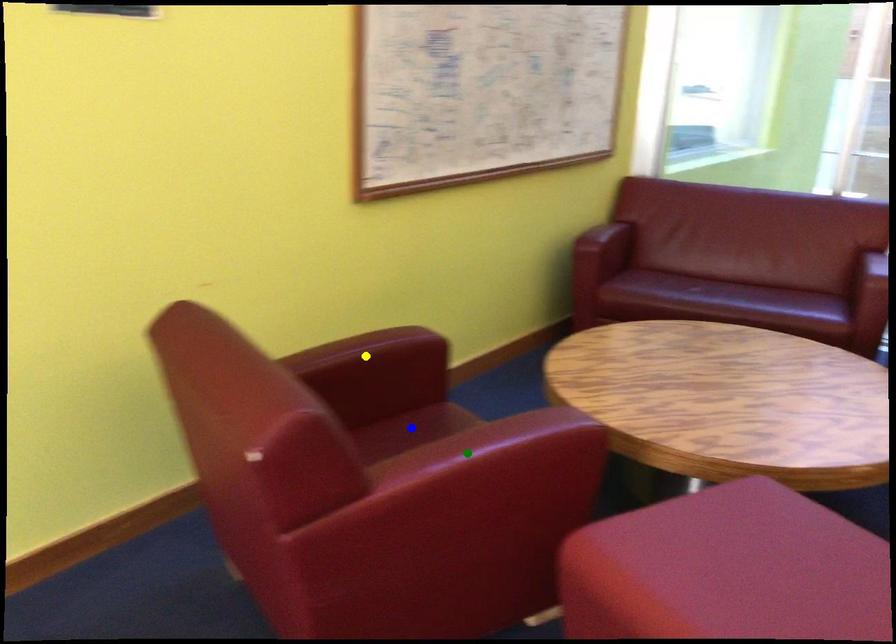
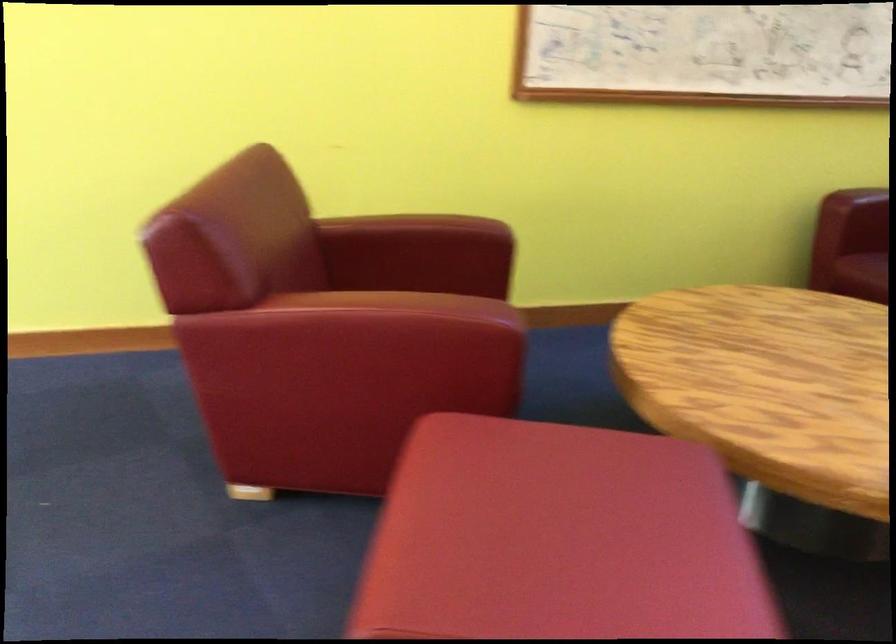
I am providing you with two images of the same scene from different viewpoints. Three points are marked in image1. Which point corresponds to a part or object that is occluded in image2?In image1, three points are marked. Which of them correspond to a part or object that is occluded in image2?Among the three points shown in image1, which one corresponds to a part or object that is no longer visible due to occlusion in image2?

blue point cannot be seen in image2.